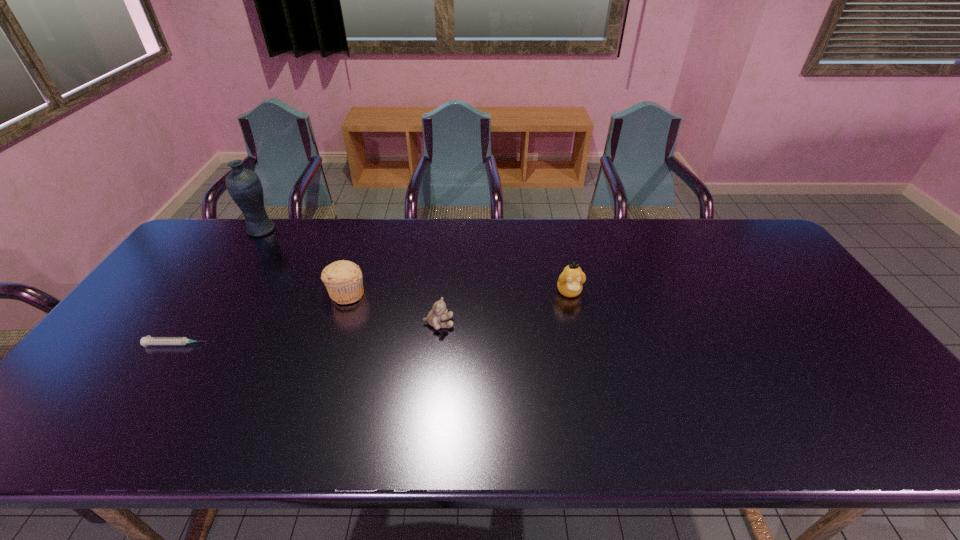
Find the location of `vase`. vase is located at coordinates (244, 186).

Find the location of `the farthest object`. the farthest object is located at coordinates (244, 186).

The height and width of the screenshot is (540, 960). In order to click on duckling in this screenshot , I will do `click(570, 281)`.

I want to click on muffin, so click(x=343, y=279).

You are a GUI agent. You are given a task and a screenshot of the screen. Output one action in this format:
    pyautogui.click(x=<x>, y=<y>)
    Task: Click on the fourth object from left to right
    This screenshot has height=540, width=960.
    Given the screenshot: What is the action you would take?
    point(439,312)

Locate an element on the screen. the second shortest object is located at coordinates (439, 312).

Find the location of a particular element. The height and width of the screenshot is (540, 960). syringe is located at coordinates [148, 340].

What are the coordinates of `the shortest object` in the screenshot? It's located at (148, 340).

What are the coordinates of `free space located on the front of the farthest object` in the screenshot? It's located at (244, 256).

Where is `vacant area situated 0.190m on the face of the duckling`? vacant area situated 0.190m on the face of the duckling is located at coordinates (584, 357).